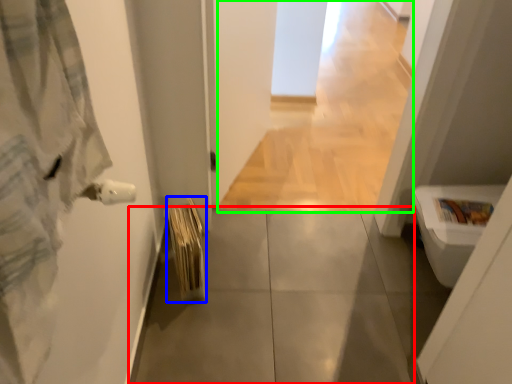
Question: Estimate the real-world distances between objects in this image. Which object is closer to concrete (highlighted by a red box), bath towel (highlighted by a blue box) or corridor (highlighted by a green box)?

Choices:
 (A) bath towel
 (B) corridor

Answer: (A)